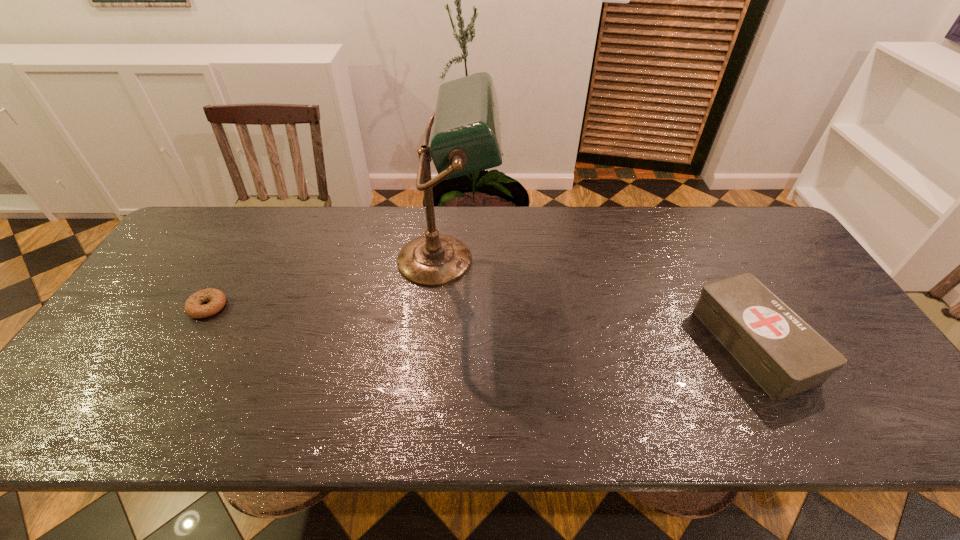
Where is `object that is positioned at the near edge`? The width and height of the screenshot is (960, 540). object that is positioned at the near edge is located at coordinates (783, 354).

Where is `object located in the left edge section of the desktop`? Image resolution: width=960 pixels, height=540 pixels. object located in the left edge section of the desktop is located at coordinates (216, 299).

Locate an element on the screen. The image size is (960, 540). object present at the right edge is located at coordinates (783, 354).

Where is `object that is at the near right corner`? The height and width of the screenshot is (540, 960). object that is at the near right corner is located at coordinates 783,354.

Identify the location of free location at the far edge of the desktop. This screenshot has width=960, height=540. (669, 230).

The image size is (960, 540). In order to click on free point at the near edge in this screenshot , I will do `click(481, 437)`.

In the image, there is a desktop. Identify the location of vacant space at the right edge. This screenshot has height=540, width=960. (876, 373).

At what (x,y) coordinates should I click in order to perform the action: click on free region at the far right corner. Please return your answer as a coordinate pair (x, y). This screenshot has height=540, width=960. Looking at the image, I should click on (751, 222).

At what (x,y) coordinates should I click in order to perform the action: click on free spot between the second object from right to left and the shortest object. Please return your answer as a coordinate pair (x, y). Image resolution: width=960 pixels, height=540 pixels. Looking at the image, I should click on (327, 283).

In order to click on free spot between the first-aid kit and the bagel in this screenshot , I will do `click(480, 326)`.